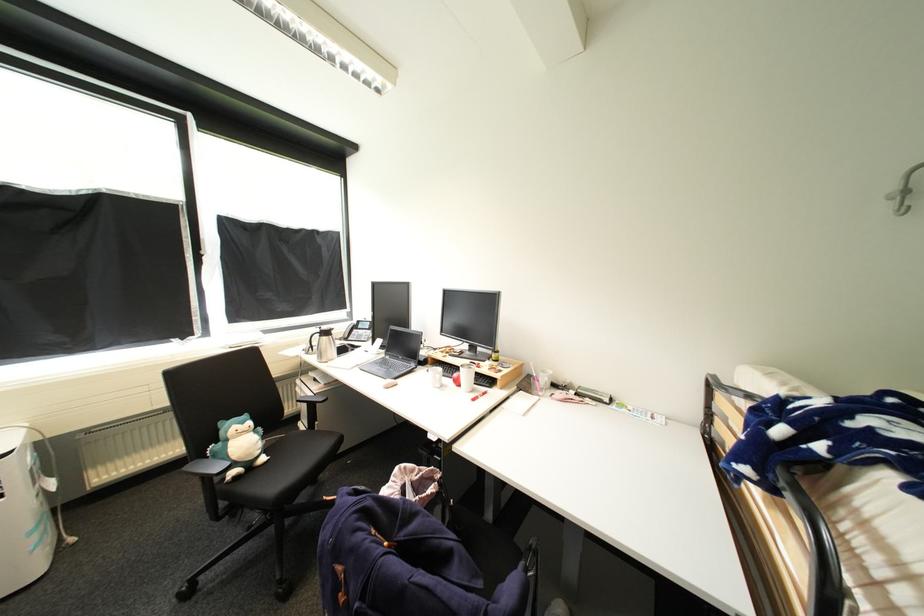
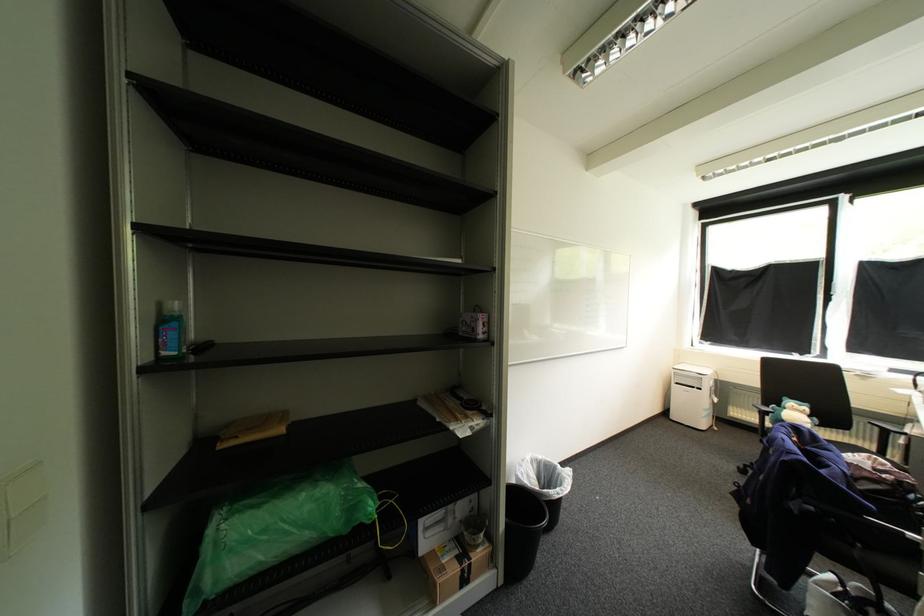
Question: I am providing you with two images of the same scene from different viewpoints. After the viewpoint changes to image2, which objects are now occluded?

Choices:
 (A) chair armrest
 (B) blue sanitizer bottle
 (C) white dish rack
 (D) black chair surface

Answer: (D)